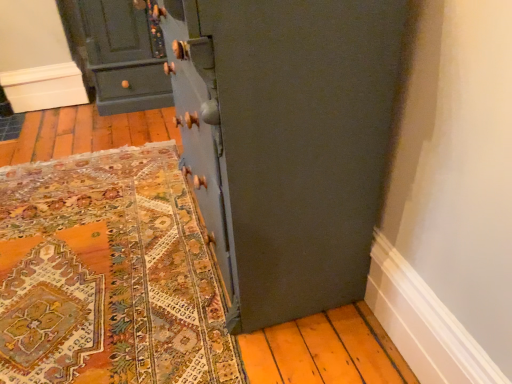
Question: Should I look upward or downward to see matte dark green cabinet at upper left?

Choices:
 (A) down
 (B) up

Answer: (B)

Question: Can you confirm if matte blue cupboard at center is bigger than matte dark green cabinet at upper left?

Choices:
 (A) no
 (B) yes

Answer: (B)

Question: Is matte blue cupboard at center beside matte dark green cabinet at upper left?

Choices:
 (A) no
 (B) yes

Answer: (A)

Question: Can you confirm if matte blue cupboard at center is positioned to the left of matte dark green cabinet at upper left?

Choices:
 (A) no
 (B) yes

Answer: (A)

Question: Could you tell me if matte blue cupboard at center is facing matte dark green cabinet at upper left?

Choices:
 (A) no
 (B) yes

Answer: (A)

Question: Considering the relative sizes of matte blue cupboard at center and matte dark green cabinet at upper left in the image provided, is matte blue cupboard at center smaller than matte dark green cabinet at upper left?

Choices:
 (A) no
 (B) yes

Answer: (A)

Question: Is matte dark green cabinet at upper left located within matte blue cupboard at center?

Choices:
 (A) no
 (B) yes

Answer: (A)

Question: From a real-world perspective, is matte dark green cabinet at upper left physically above matte blue cupboard at center?

Choices:
 (A) yes
 (B) no

Answer: (B)

Question: Does matte dark green cabinet at upper left contain matte blue cupboard at center?

Choices:
 (A) no
 (B) yes

Answer: (A)

Question: Is matte dark green cabinet at upper left to the left of matte blue cupboard at center from the viewer's perspective?

Choices:
 (A) yes
 (B) no

Answer: (A)

Question: Does matte dark green cabinet at upper left have a lesser width compared to matte blue cupboard at center?

Choices:
 (A) yes
 (B) no

Answer: (B)

Question: Can you confirm if matte dark green cabinet at upper left is bigger than matte blue cupboard at center?

Choices:
 (A) yes
 (B) no

Answer: (B)

Question: Can we say matte dark green cabinet at upper left lies outside matte blue cupboard at center?

Choices:
 (A) yes
 (B) no

Answer: (A)

Question: In terms of width, does matte dark green cabinet at upper left look wider or thinner when compared to matte blue cupboard at center?

Choices:
 (A) thin
 (B) wide

Answer: (B)